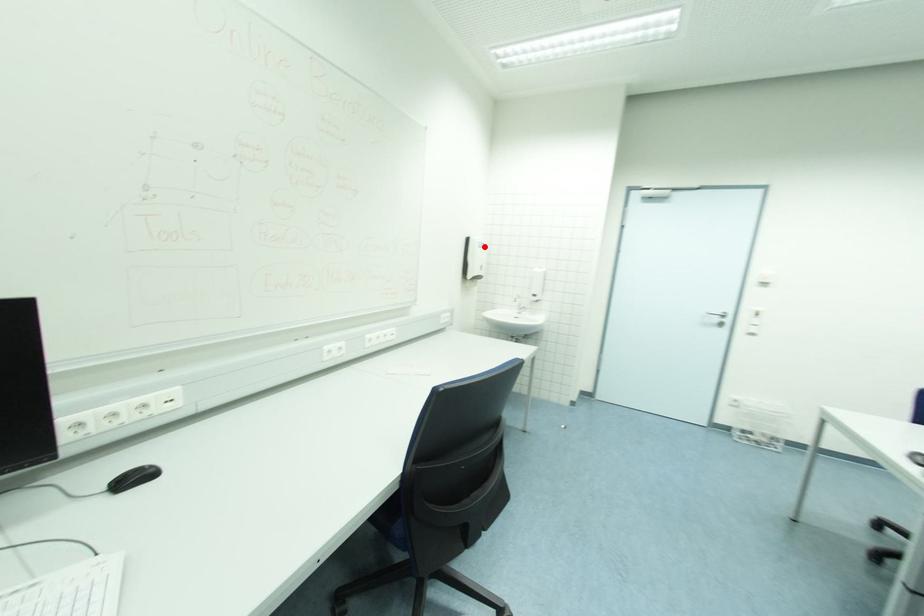
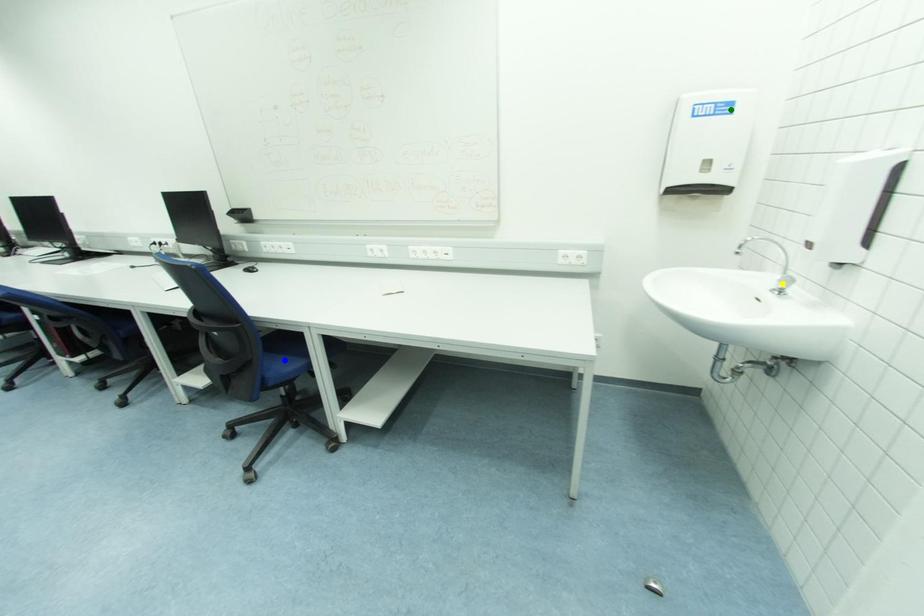
Question: I am providing you with two images of the same scene from different viewpoints. A red point is marked on the first image. You are given multiple points on the second image. Which point in image 2 is actually the same real-world point as the red point in image 1?

Choices:
 (A) blue point
 (B) green point
 (C) yellow point

Answer: (B)